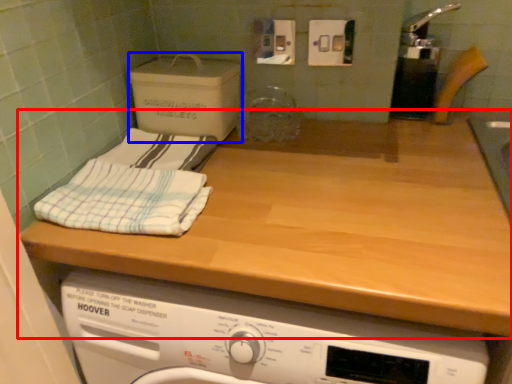
Question: Which point is further to the camera, countertop (highlighted by a red box) or cardboard box (highlighted by a blue box)?

Choices:
 (A) countertop
 (B) cardboard box

Answer: (B)